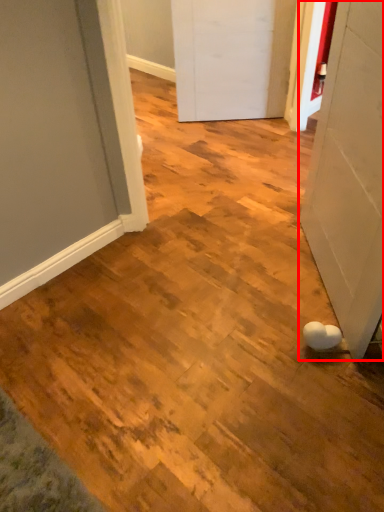
Question: Considering the relative positions of door (annotated by the red box) and door in the image provided, where is door (annotated by the red box) located with respect to the staircase?

Choices:
 (A) right
 (B) left

Answer: (A)